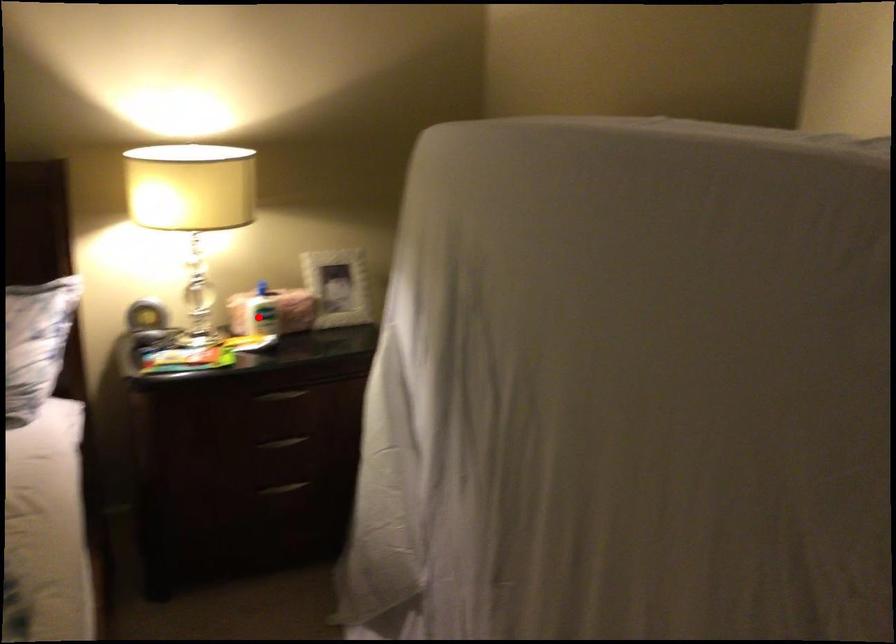
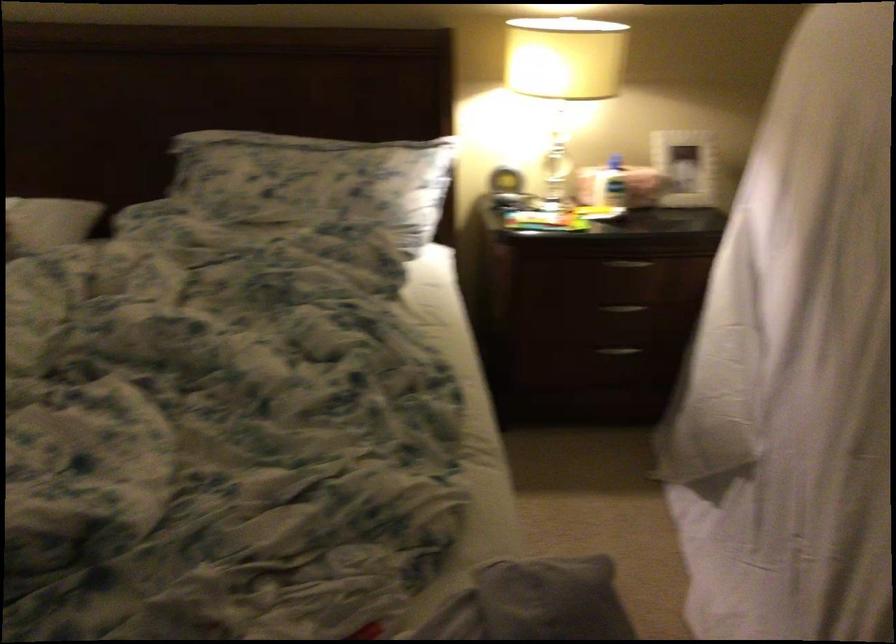
Where in the second image is the point corresponding to the highlighted location from the first image?

(609, 184)